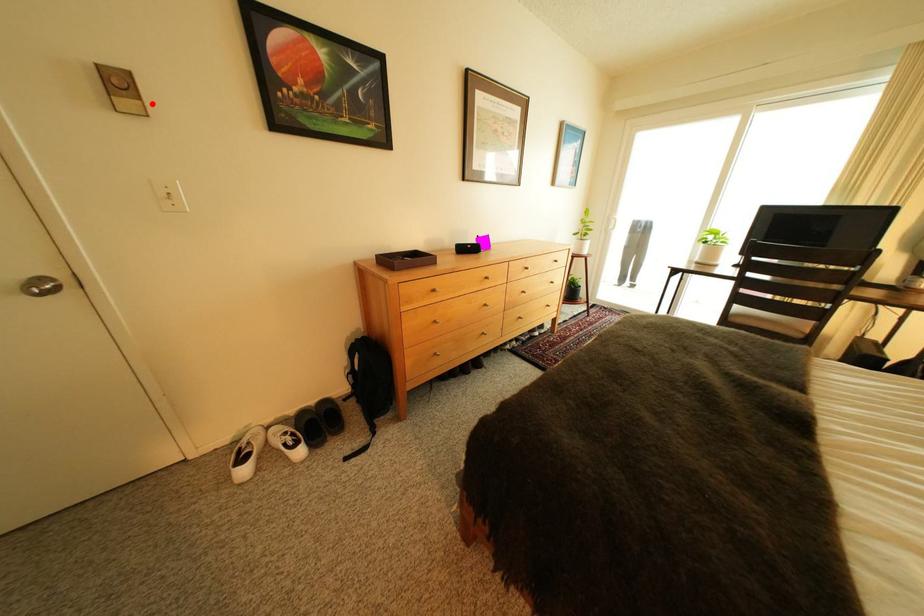
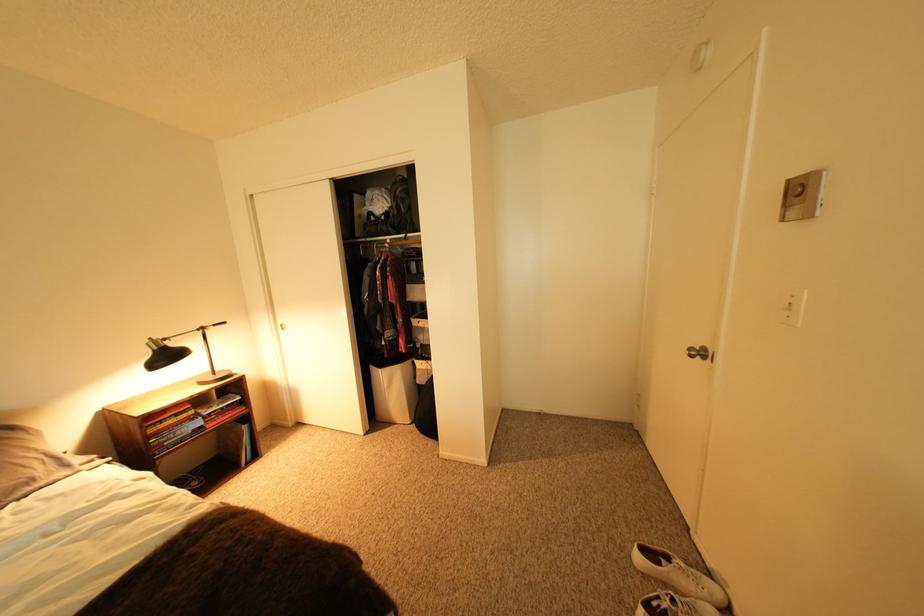
Where in the second image is the point corresponding to the highlighted location from the first image?

(816, 207)